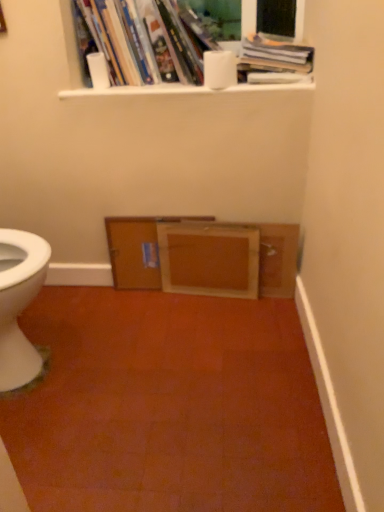
Question: From a real-world perspective, is hardcover books at upper center, the 2th book when ordered from right to left, above or below white matte toilet paper at upper center, the second toilet paper when ordered from right to left?

Choices:
 (A) below
 (B) above

Answer: (B)

Question: Is hardcover books at upper center, the 2th book when ordered from right to left, inside or outside of white matte toilet paper at upper center, the second toilet paper when ordered from right to left?

Choices:
 (A) outside
 (B) inside

Answer: (A)

Question: Estimate the real-world distances between objects in this image. Which object is farther from the white glossy window sill at upper center?

Choices:
 (A) wooden cabinet at center, placed as the first file cabinet when sorted from left to right
 (B) wooden frame at center
 (C) white matte toilet paper at upper center, arranged as the second toilet paper when viewed from the left
 (D) hardcover books at upper center, which is counted as the first book, starting from the left
 (E) hardcover book at upper center, positioned as the first book in right-to-left order

Answer: (A)

Question: Which is farther from the wooden frame at center?

Choices:
 (A) wooden cabinet at center, placed as the first file cabinet when sorted from left to right
 (B) white matte toilet paper at upper center, the second toilet paper when ordered from right to left
 (C) white matte toilet paper at upper center, which is counted as the first toilet paper, starting from the right
 (D) wooden frame at center, acting as the 2th file cabinet starting from the left
 (E) white glossy window sill at upper center

Answer: (C)